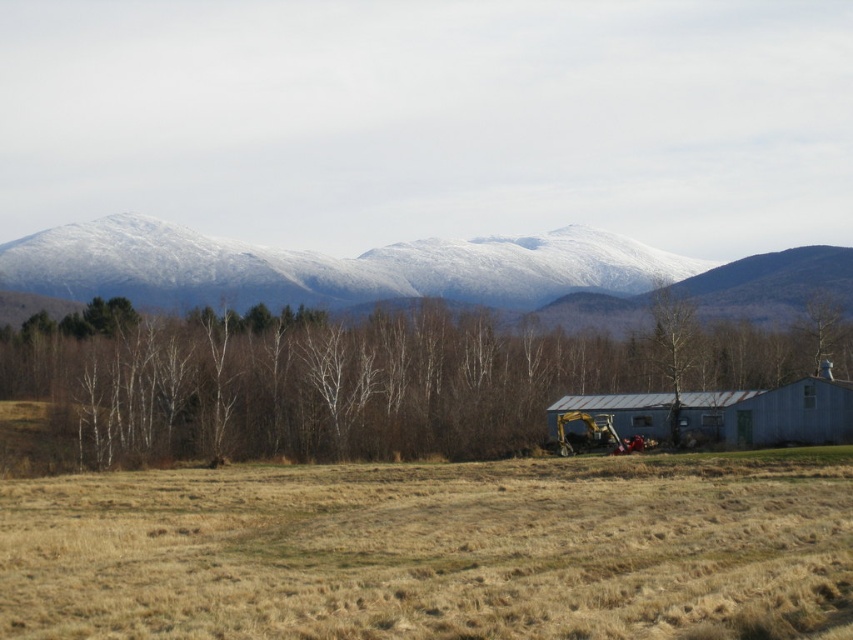
Question: Estimate the real-world distances between objects in this image. Which object is farther from the snow-covered mountain at upper center?

Choices:
 (A) brown leafless trees at center
 (B) brown grassy field at lower center

Answer: (B)

Question: Is brown leafless trees at center bigger than snow-covered mountain at upper center?

Choices:
 (A) no
 (B) yes

Answer: (A)

Question: Which point appears farthest from the camera in this image?

Choices:
 (A) (293, 467)
 (B) (672, 392)

Answer: (B)

Question: Can you confirm if brown grassy field at lower center is bigger than brown leafless trees at center?

Choices:
 (A) yes
 (B) no

Answer: (B)

Question: Does brown leafless trees at center have a smaller size compared to smooth white tree at center?

Choices:
 (A) yes
 (B) no

Answer: (B)

Question: Considering the real-world distances, which object is farthest from the smooth white tree at center?

Choices:
 (A) snow-covered mountain at upper center
 (B) brown grassy field at lower center
 (C) brown leafless trees at center

Answer: (B)